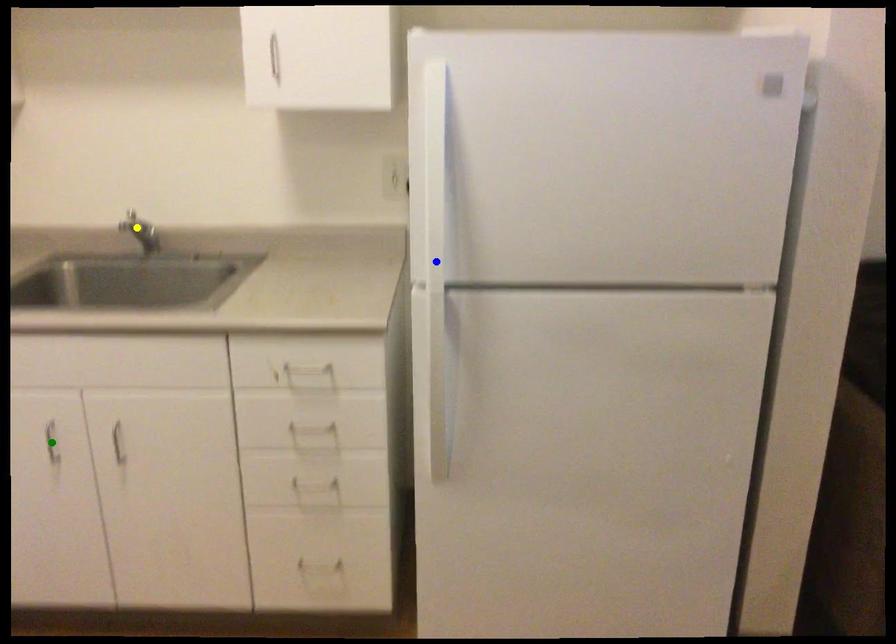
Order these from farthest to nearest:
- green point
- yellow point
- blue point

yellow point
green point
blue point